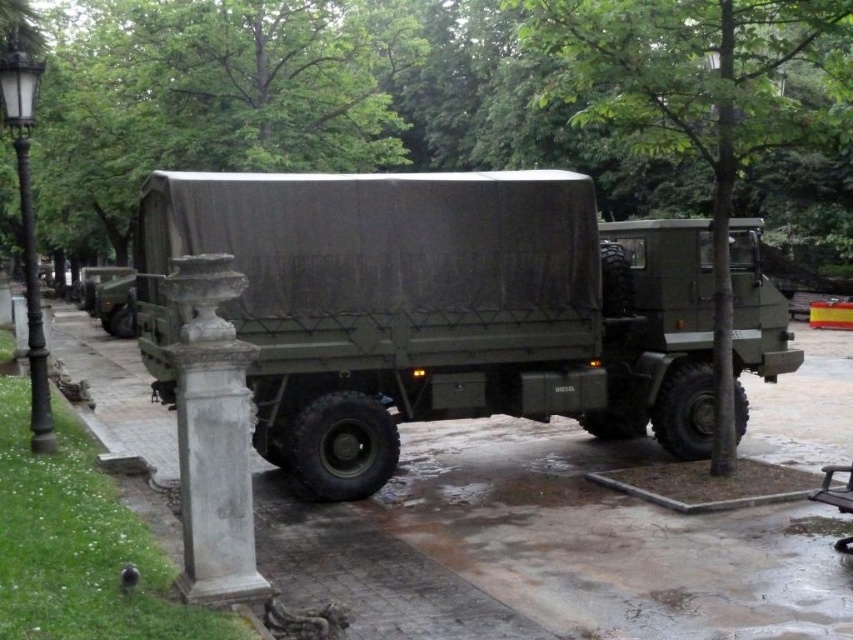
You are a photographer setting up a tripod to take a photo of the matte green truck at center and the white stone column at lower left. You want to ensure both objects are in frame. Based on their heights, which object should you position closer to the camera to avoid cropping?

The matte green truck at center is not as tall as the white stone column at lower left, so you should position the white stone column at lower left closer to the camera to ensure both are fully visible without cropping.

You are a photographer trying to capture the matte green truck at center from a specific location. What are the coordinates where you should position yourself to ensure the truck is centered in your shot?

The coordinates to position yourself to center the matte green truck at center are at point (437,308).